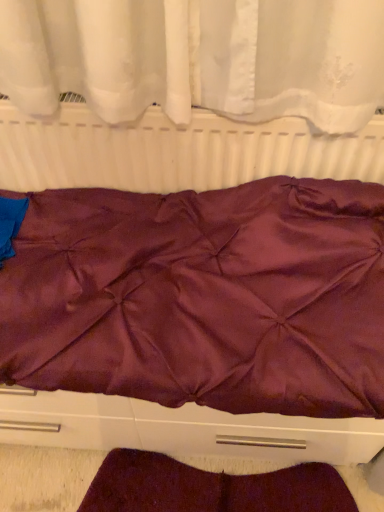
At what (x,y) coordinates should I click in order to perform the action: click on vacant area on top of matte white radiator at center (from a real-world perspective). Please return your answer as a coordinate pair (x, y). Looking at the image, I should click on (164, 102).